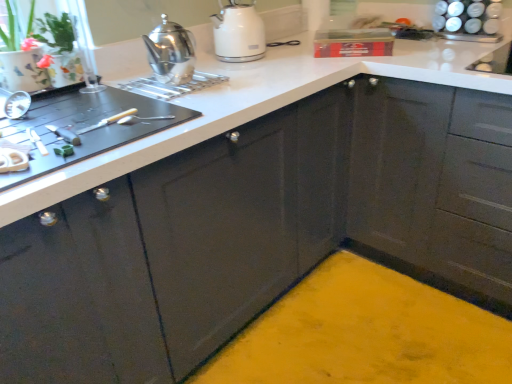
Where is `white glossy spice rack at upper right`? The width and height of the screenshot is (512, 384). white glossy spice rack at upper right is located at coordinates (468, 20).

Where is `polished stainless steel teapot at upper left, arranged as the first kitchen appliance when viewed from the front`? Image resolution: width=512 pixels, height=384 pixels. polished stainless steel teapot at upper left, arranged as the first kitchen appliance when viewed from the front is located at coordinates (170, 52).

Consider the image. In order to face polished stainless steel teapot at upper left, arranged as the first kitchen appliance when viewed from the front, should I rotate leftwards or rightwards?

To align with it, rotate left about 11.720°.

At what (x,y) coordinates should I click in order to perform the action: click on glossy dark gray cabinet at upper right. Please return your answer as a coordinate pair (x, y). The height and width of the screenshot is (384, 512). Looking at the image, I should click on (435, 179).

You are a GUI agent. You are given a task and a screenshot of the screen. Output one action in this format:
    pyautogui.click(x=<x>, y=<y>)
    Task: Click on the black rubber cutting board at left
    
    Given the screenshot: What is the action you would take?
    pyautogui.click(x=85, y=126)

How much distance is there between textured ceramic pot at upper left and white glossy kettle at upper center, arranged as the first kitchen appliance when viewed from the right?

textured ceramic pot at upper left is 22.47 inches from white glossy kettle at upper center, arranged as the first kitchen appliance when viewed from the right.

From a real-world perspective, relative to white glossy kettle at upper center, which is the first kitchen appliance in back-to-front order, is textured ceramic pot at upper left vertically above or below?

textured ceramic pot at upper left is situated higher than white glossy kettle at upper center, which is the first kitchen appliance in back-to-front order, in the real world.

Could you tell me if textured ceramic pot at upper left is facing white glossy kettle at upper center, which is counted as the second kitchen appliance, starting from the left?

No, textured ceramic pot at upper left is not turned towards white glossy kettle at upper center, which is counted as the second kitchen appliance, starting from the left.

Between textured ceramic pot at upper left and white glossy kettle at upper center, which is counted as the second kitchen appliance, starting from the left, which one is positioned behind?

Positioned behind is white glossy kettle at upper center, which is counted as the second kitchen appliance, starting from the left.

Is glossy dark gray cabinet at upper right beside polished stainless steel teapot at upper left, arranged as the first kitchen appliance when viewed from the front?

No.

Image resolution: width=512 pixels, height=384 pixels. In order to click on the 1st kitchen appliance behind when counting from the glossy dark gray cabinet at upper right in this screenshot , I will do `click(170, 52)`.

Considering the positions of objects glossy dark gray cabinet at upper right and polished stainless steel teapot at upper left, arranged as the first kitchen appliance when viewed from the front, in the image provided, who is in front, glossy dark gray cabinet at upper right or polished stainless steel teapot at upper left, arranged as the first kitchen appliance when viewed from the front,?

Positioned in front is glossy dark gray cabinet at upper right.

Is glossy dark gray cabinet at upper right oriented towards polished stainless steel teapot at upper left, arranged as the 2th kitchen appliance when viewed from the back?

No, glossy dark gray cabinet at upper right is not turned towards polished stainless steel teapot at upper left, arranged as the 2th kitchen appliance when viewed from the back.

Is polished stainless steel teapot at upper left, which appears as the 1th kitchen appliance when viewed from the left, spatially inside white glossy spice rack at upper right, or outside of it?

polished stainless steel teapot at upper left, which appears as the 1th kitchen appliance when viewed from the left, is located beyond the bounds of white glossy spice rack at upper right.

Which of these two, polished stainless steel teapot at upper left, which is counted as the second kitchen appliance, starting from the right, or white glossy spice rack at upper right, is smaller?

polished stainless steel teapot at upper left, which is counted as the second kitchen appliance, starting from the right.

In order to click on appliance that appears above the polished stainless steel teapot at upper left, which is counted as the second kitchen appliance, starting from the right (from the image's perspective) in this screenshot , I will do click(x=468, y=20).

From the image's perspective, does polished stainless steel teapot at upper left, which is counted as the second kitchen appliance, starting from the right, appear lower than white glossy spice rack at upper right?

Yes, from the image's perspective, polished stainless steel teapot at upper left, which is counted as the second kitchen appliance, starting from the right, is beneath white glossy spice rack at upper right.

Is polished stainless steel teapot at upper left, arranged as the first kitchen appliance when viewed from the front, not within glossy dark gray cabinet at upper right?

Yes, polished stainless steel teapot at upper left, arranged as the first kitchen appliance when viewed from the front, is located beyond the bounds of glossy dark gray cabinet at upper right.

Which object is closer to the camera, polished stainless steel teapot at upper left, which appears as the 1th kitchen appliance when viewed from the left, or glossy dark gray cabinet at upper right?

glossy dark gray cabinet at upper right is more forward.

Could you tell me if polished stainless steel teapot at upper left, which is counted as the second kitchen appliance, starting from the right, is turned towards glossy dark gray cabinet at upper right?

No, polished stainless steel teapot at upper left, which is counted as the second kitchen appliance, starting from the right, does not turn towards glossy dark gray cabinet at upper right.

From the image's perspective, would you say white glossy kettle at upper center, the second kitchen appliance from the front, is shown under polished stainless steel teapot at upper left, which appears as the 1th kitchen appliance when viewed from the left?

Actually, white glossy kettle at upper center, the second kitchen appliance from the front, appears above polished stainless steel teapot at upper left, which appears as the 1th kitchen appliance when viewed from the left, in the image.

Considering the sizes of objects white glossy kettle at upper center, arranged as the first kitchen appliance when viewed from the right, and polished stainless steel teapot at upper left, arranged as the first kitchen appliance when viewed from the front, in the image provided, who is shorter, white glossy kettle at upper center, arranged as the first kitchen appliance when viewed from the right, or polished stainless steel teapot at upper left, arranged as the first kitchen appliance when viewed from the front,?

polished stainless steel teapot at upper left, arranged as the first kitchen appliance when viewed from the front.

Considering their positions, is white glossy kettle at upper center, which is counted as the second kitchen appliance, starting from the left, located in front of or behind polished stainless steel teapot at upper left, arranged as the first kitchen appliance when viewed from the front?

Clearly, white glossy kettle at upper center, which is counted as the second kitchen appliance, starting from the left, is behind polished stainless steel teapot at upper left, arranged as the first kitchen appliance when viewed from the front.

From a real-world perspective, between white glossy kettle at upper center, arranged as the first kitchen appliance when viewed from the right, and polished stainless steel teapot at upper left, arranged as the 2th kitchen appliance when viewed from the back, who is vertically higher?

polished stainless steel teapot at upper left, arranged as the 2th kitchen appliance when viewed from the back, from a real-world perspective.

From a real-world perspective, is white glossy countertop at center above or below white glossy spice rack at upper right?

white glossy countertop at center is situated lower than white glossy spice rack at upper right in the real world.

Does white glossy countertop at center have a smaller size compared to white glossy spice rack at upper right?

Incorrect, white glossy countertop at center is not smaller in size than white glossy spice rack at upper right.

Is white glossy countertop at center inside or outside of white glossy spice rack at upper right?

white glossy countertop at center is spatially situated outside white glossy spice rack at upper right.

Is white glossy countertop at center taller than white glossy spice rack at upper right?

Correct, white glossy countertop at center is much taller as white glossy spice rack at upper right.

Is white glossy spice rack at upper right beside white glossy kettle at upper center, arranged as the first kitchen appliance when viewed from the right?

No.

Is the depth of white glossy spice rack at upper right greater than that of white glossy kettle at upper center, arranged as the first kitchen appliance when viewed from the right?

Yes, white glossy spice rack at upper right is behind white glossy kettle at upper center, arranged as the first kitchen appliance when viewed from the right.

Is point (454, 6) in front of point (221, 58)?

No, (454, 6) is behind (221, 58).

From a real-world perspective, is white glossy spice rack at upper right physically located above or below white glossy kettle at upper center, arranged as the first kitchen appliance when viewed from the right?

From a real-world perspective, white glossy spice rack at upper right is physically below white glossy kettle at upper center, arranged as the first kitchen appliance when viewed from the right.

Where is `the 2nd kitchen appliance to the right of the textured ceramic pot at upper left, starting your count from the anchor`? The image size is (512, 384). the 2nd kitchen appliance to the right of the textured ceramic pot at upper left, starting your count from the anchor is located at coordinates (238, 33).

Where is `cabinetry located below the polished stainless steel teapot at upper left, arranged as the first kitchen appliance when viewed from the front (from the image's perspective)`? The height and width of the screenshot is (384, 512). cabinetry located below the polished stainless steel teapot at upper left, arranged as the first kitchen appliance when viewed from the front (from the image's perspective) is located at coordinates (435, 179).

Estimate the real-world distances between objects in this image. Which object is further from white glossy kettle at upper center, the second kitchen appliance from the front, glossy dark gray cabinet at upper right or textured ceramic pot at upper left?

Based on the image, glossy dark gray cabinet at upper right appears to be further to white glossy kettle at upper center, the second kitchen appliance from the front.

Which object lies further to the anchor point black rubber cutting board at left, white glossy kettle at upper center, which is counted as the second kitchen appliance, starting from the left, or white glossy countertop at center?

white glossy kettle at upper center, which is counted as the second kitchen appliance, starting from the left, lies further to black rubber cutting board at left than the other object.

Based on their spatial positions, is white glossy kettle at upper center, which is counted as the second kitchen appliance, starting from the left, or textured ceramic pot at upper left further from black rubber cutting board at left?

white glossy kettle at upper center, which is counted as the second kitchen appliance, starting from the left.

Which object lies nearer to the anchor point textured ceramic pot at upper left, white glossy kettle at upper center, which is counted as the second kitchen appliance, starting from the left, or polished stainless steel teapot at upper left, arranged as the 2th kitchen appliance when viewed from the back?

Based on the image, polished stainless steel teapot at upper left, arranged as the 2th kitchen appliance when viewed from the back, appears to be nearer to textured ceramic pot at upper left.

Based on their spatial positions, is white glossy countertop at center or white glossy spice rack at upper right further from polished stainless steel teapot at upper left, arranged as the 2th kitchen appliance when viewed from the back?

Based on the image, white glossy spice rack at upper right appears to be further to polished stainless steel teapot at upper left, arranged as the 2th kitchen appliance when viewed from the back.

Which object lies further to the anchor point white glossy spice rack at upper right, white glossy kettle at upper center, arranged as the first kitchen appliance when viewed from the right, or white glossy countertop at center?

white glossy kettle at upper center, arranged as the first kitchen appliance when viewed from the right, lies further to white glossy spice rack at upper right than the other object.

Looking at the image, which one is located further to white glossy countertop at center, black rubber cutting board at left or glossy dark gray cabinet at upper right?

glossy dark gray cabinet at upper right.

When comparing their distances from textured ceramic pot at upper left, does black rubber cutting board at left or white glossy countertop at center seem further?

Based on the image, white glossy countertop at center appears to be further to textured ceramic pot at upper left.

This screenshot has width=512, height=384. I want to click on home appliance situated between textured ceramic pot at upper left and white glossy kettle at upper center, the second kitchen appliance from the front, from left to right, so click(x=85, y=126).

Locate an element on the screen. Image resolution: width=512 pixels, height=384 pixels. cabinetry situated between white glossy countertop at center and white glossy spice rack at upper right from left to right is located at coordinates (435, 179).

You are a GUI agent. You are given a task and a screenshot of the screen. Output one action in this format:
    pyautogui.click(x=<x>, y=<y>)
    Task: Click on the countertop between polished stainless steel teapot at upper left, arranged as the first kitchen appliance when viewed from the front, and white glossy spice rack at upper right from left to right
    Image resolution: width=512 pixels, height=384 pixels.
    Given the screenshot: What is the action you would take?
    pyautogui.click(x=256, y=105)

Identify the location of countertop located between textured ceramic pot at upper left and white glossy spice rack at upper right in the left-right direction. Image resolution: width=512 pixels, height=384 pixels. (256, 105).